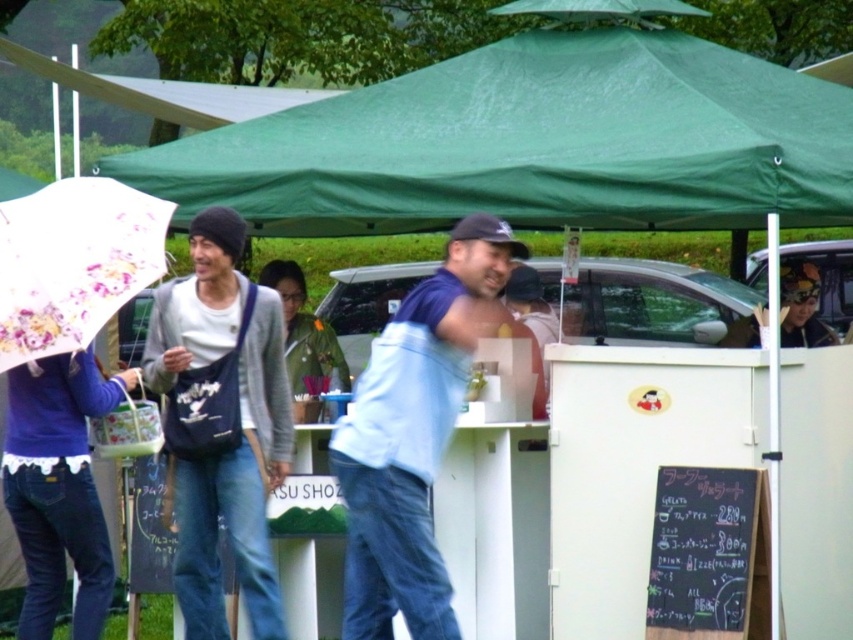
Question: Where is matte gray sweater at center located in relation to light blue fabric jacket at center in the image?

Choices:
 (A) below
 (B) above

Answer: (A)

Question: Which object is farther from the camera taking this photo?

Choices:
 (A) light blue fabric jacket at center
 (B) floral paper umbrella at left
 (C) green fabric canopy at upper center

Answer: (C)

Question: Is light blue fabric jacket at center positioned behind floral paper umbrella at left?

Choices:
 (A) no
 (B) yes

Answer: (A)

Question: Which point is closer to the camera?

Choices:
 (A) (490, 176)
 (B) (369, 390)

Answer: (B)

Question: Is matte gray sweater at center wider than light blue fabric jacket at center?

Choices:
 (A) no
 (B) yes

Answer: (A)

Question: Estimate the real-world distances between objects in this image. Which object is closer to the floral paper umbrella at left?

Choices:
 (A) matte gray sweater at center
 (B) light blue fabric jacket at center
 (C) green fabric canopy at upper center

Answer: (A)